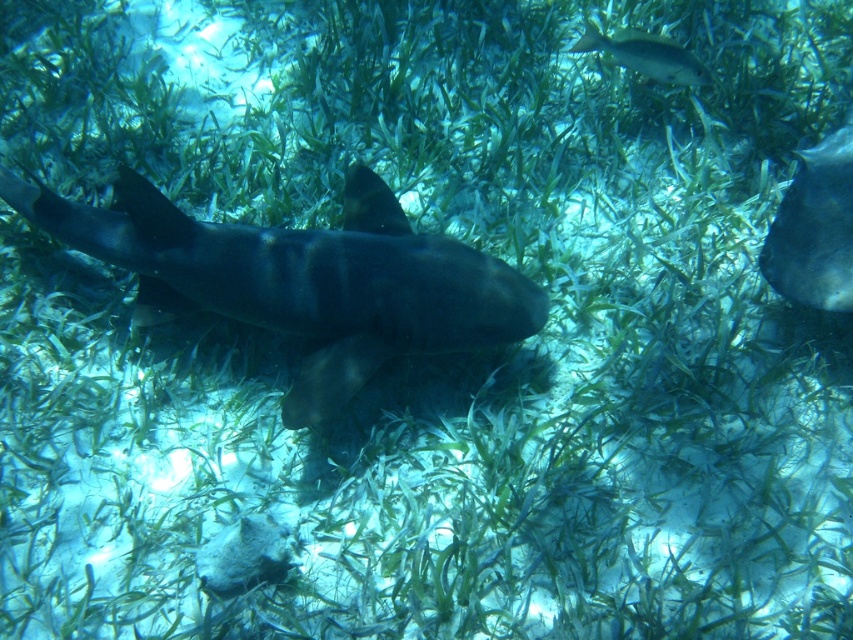
Question: Which of the following is the farthest from the observer?

Choices:
 (A) smooth gray stingray at right
 (B) shiny silver fish at upper right
 (C) dark gray matte shark at center

Answer: (B)

Question: Considering the real-world distances, which object is farthest from the smooth gray stingray at right?

Choices:
 (A) dark gray matte shark at center
 (B) shiny silver fish at upper right

Answer: (A)

Question: Which object is closer to the camera taking this photo?

Choices:
 (A) shiny silver fish at upper right
 (B) smooth gray stingray at right
 (C) dark gray matte shark at center

Answer: (C)

Question: Does smooth gray stingray at right have a larger size compared to shiny silver fish at upper right?

Choices:
 (A) yes
 (B) no

Answer: (A)

Question: Is dark gray matte shark at center to the right of smooth gray stingray at right from the viewer's perspective?

Choices:
 (A) no
 (B) yes

Answer: (A)

Question: Is dark gray matte shark at center smaller than smooth gray stingray at right?

Choices:
 (A) no
 (B) yes

Answer: (A)